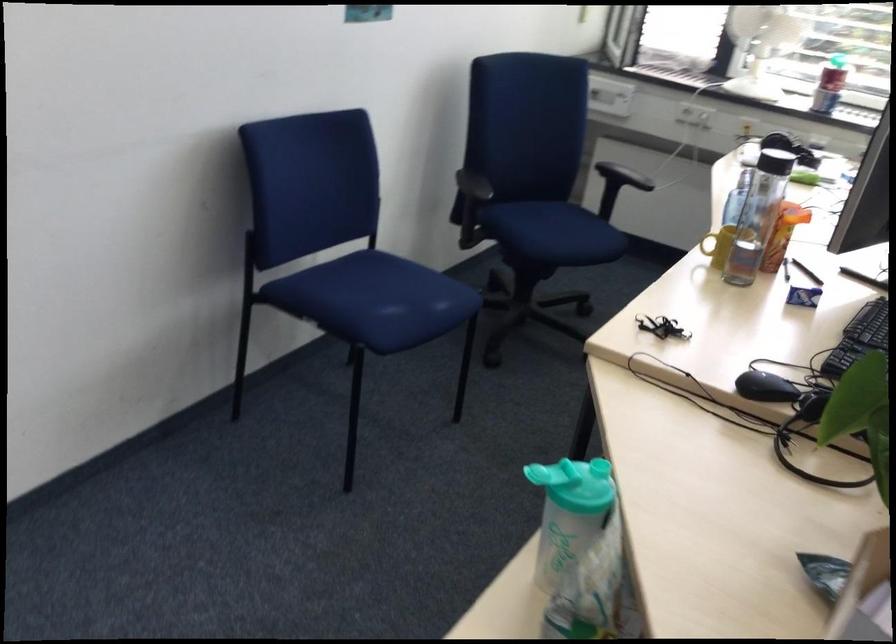
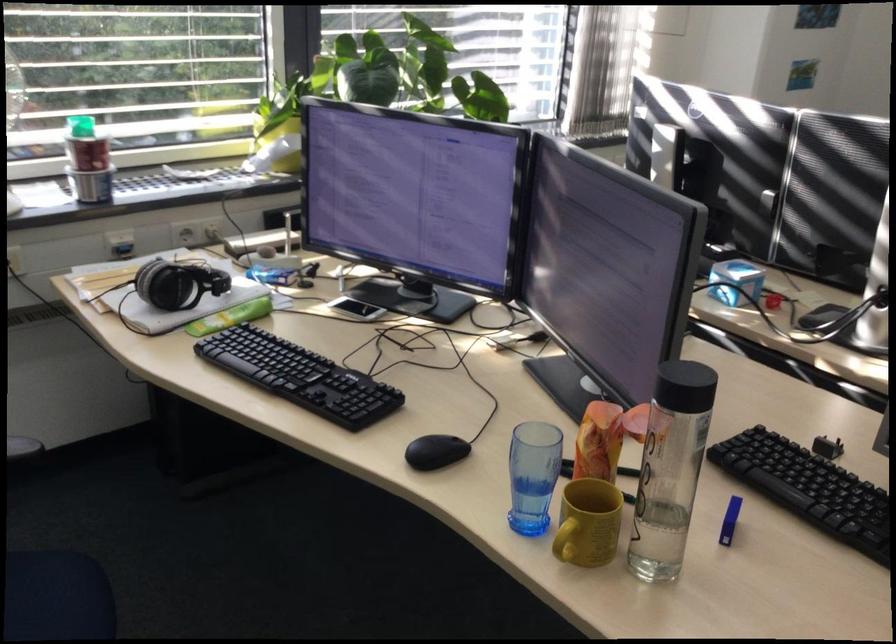
The point at (712, 247) is marked in the first image. Where is the corresponding point in the second image?

(564, 547)